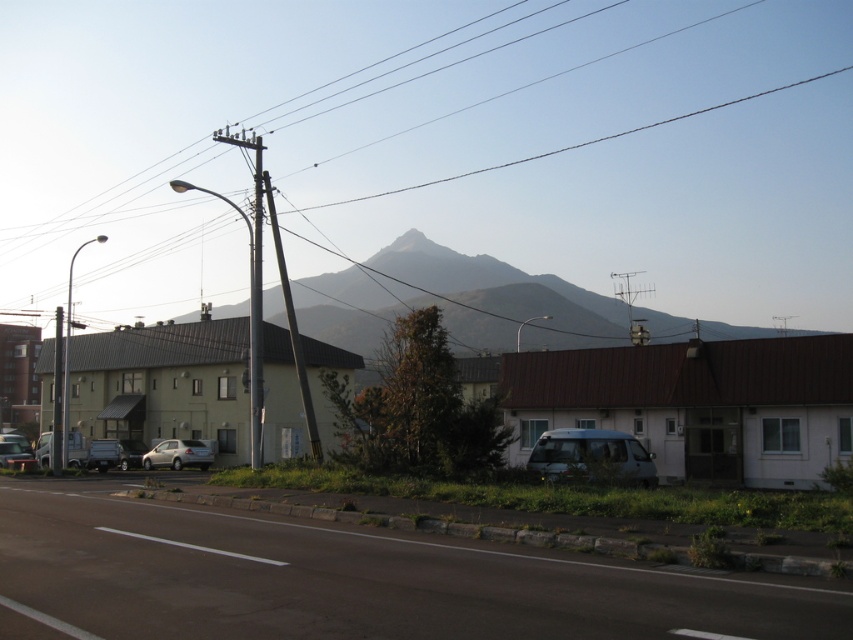
You are a bird flying over the suburban scene. You see the metallic wire at upper center and the metallic gray telegraph pole at left. Which object is higher from the ground?

The metallic wire at upper center is above the metallic gray telegraph pole at left, so it is higher from the ground.

You are a delivery driver who needs to pass through the area shown in the image. There is a metallic wire at upper center and a metallic gray telegraph pole at center. Which object is wider from your perspective?

The metallic wire at upper center is wider than the metallic gray telegraph pole at center from your perspective.